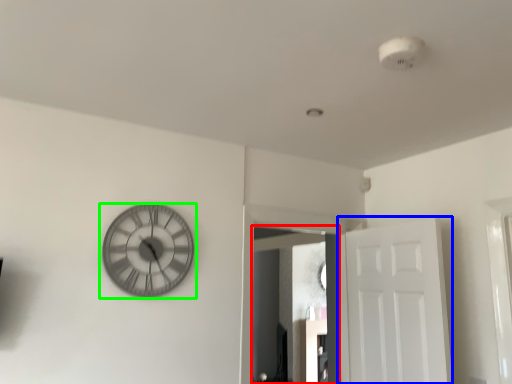
Question: Which object is the closest to the mirror (highlighted by a red box)? Choose among these: door (highlighted by a blue box) or wall clock (highlighted by a green box).

Choices:
 (A) door
 (B) wall clock

Answer: (A)